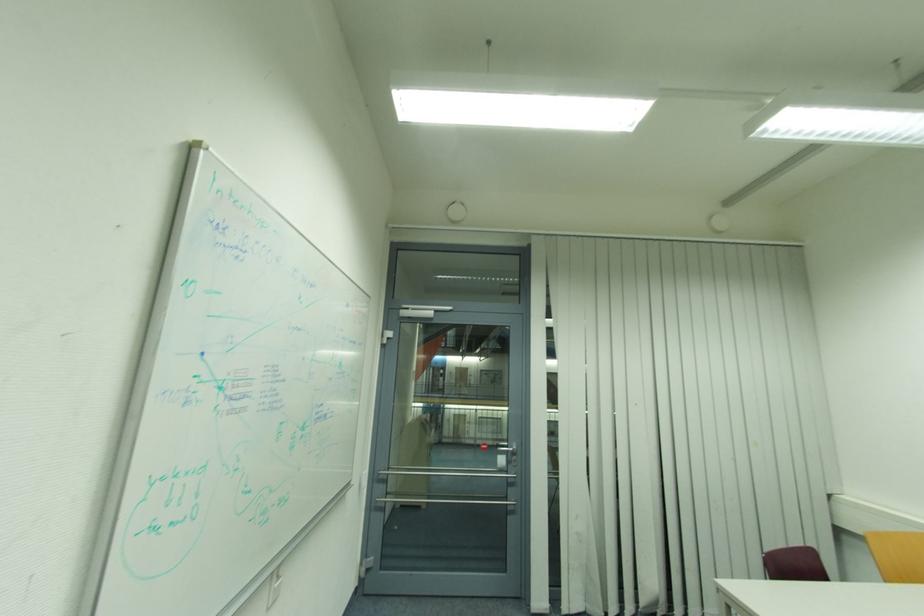
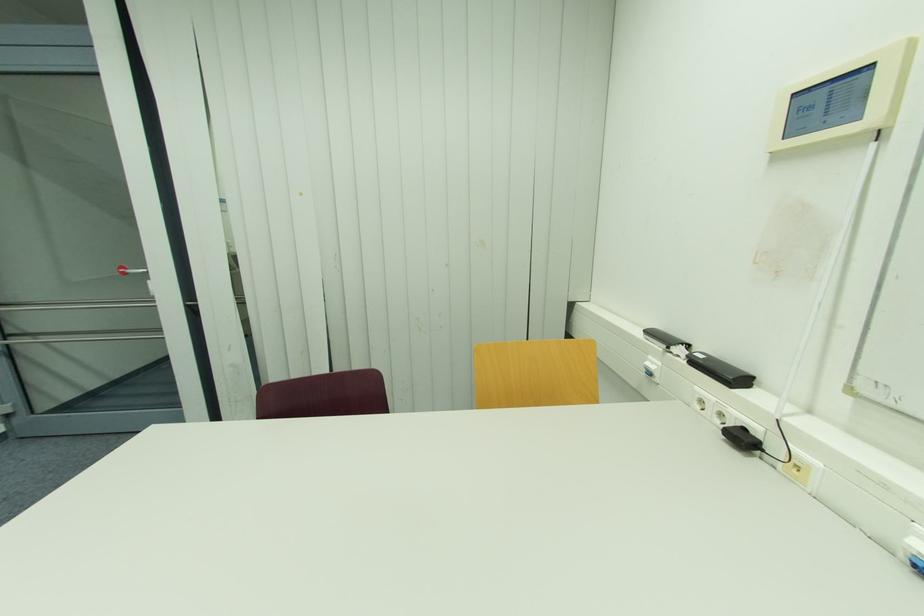
Looking at this image, the images are taken continuously from a first-person perspective. In which direction are you moving?

The cameraman moved toward right, forward.